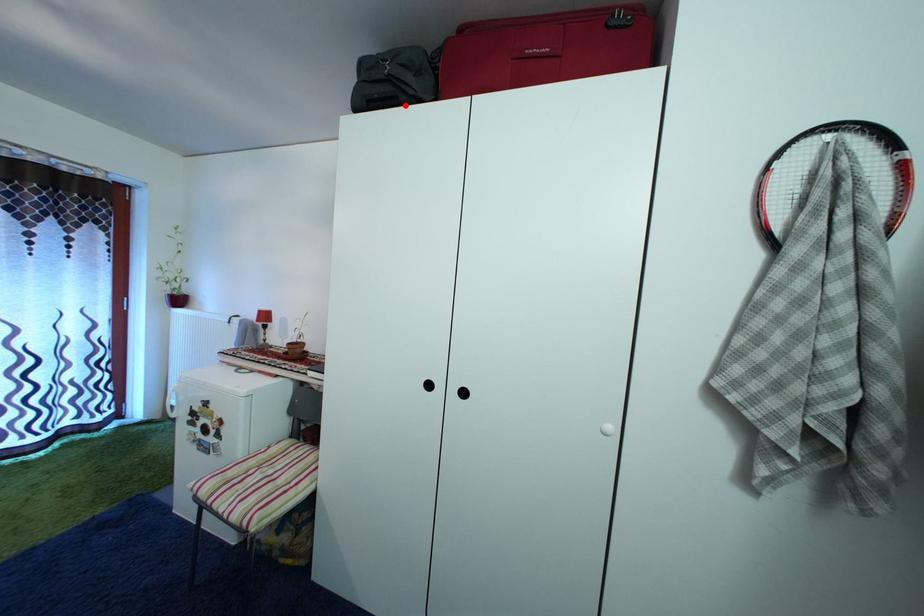
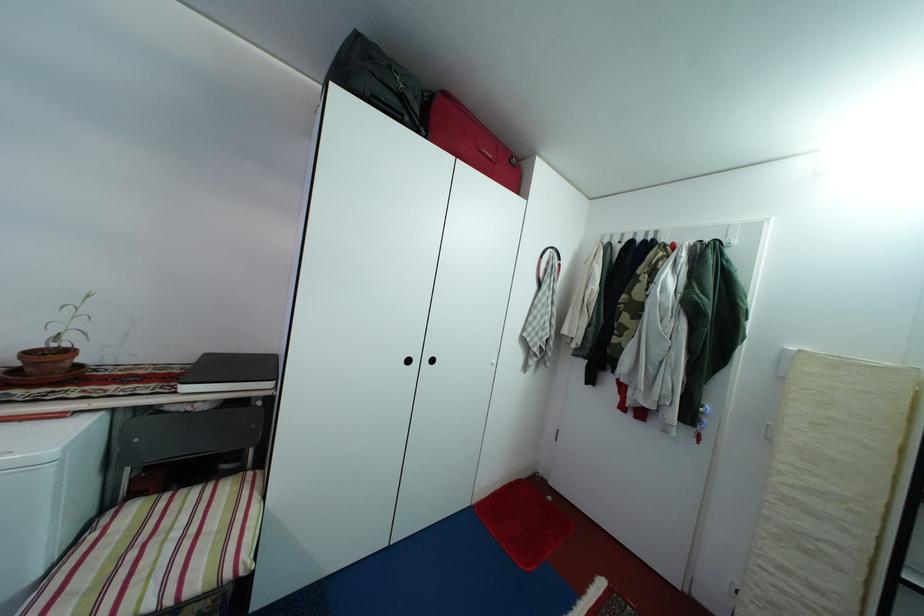
Where in the second image is the point corresponding to the highlighted location from the first image?

(410, 123)